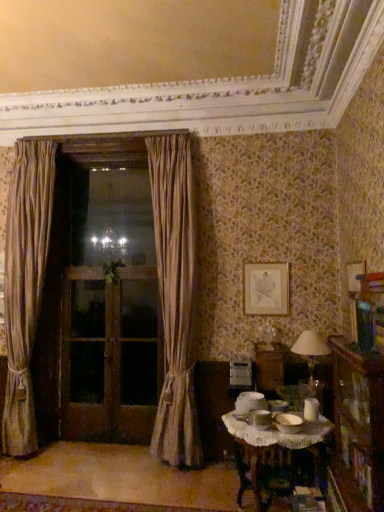
Question: Is wooden bookcase at lower right wider than brown wooden screen door at left, which ranks as the third screen door in right-to-left order?

Choices:
 (A) no
 (B) yes

Answer: (B)

Question: Can you confirm if wooden bookcase at lower right is thinner than brown wooden screen door at left, which is counted as the first screen door, starting from the left?

Choices:
 (A) yes
 (B) no

Answer: (B)

Question: Is wooden bookcase at lower right bigger than brown wooden screen door at left, which is counted as the first screen door, starting from the left?

Choices:
 (A) no
 (B) yes

Answer: (B)

Question: Does wooden bookcase at lower right touch brown wooden screen door at left, which ranks as the third screen door in right-to-left order?

Choices:
 (A) yes
 (B) no

Answer: (B)

Question: Does wooden bookcase at lower right contain brown wooden screen door at left, which is counted as the first screen door, starting from the left?

Choices:
 (A) yes
 (B) no

Answer: (B)

Question: In the image, is white fabric lampshade at right positioned in front of or behind white lace tablecloth at lower right?

Choices:
 (A) behind
 (B) front

Answer: (A)

Question: From the image's perspective, is white fabric lampshade at right above or below white lace tablecloth at lower right?

Choices:
 (A) above
 (B) below

Answer: (A)

Question: Choose the correct answer: Is white fabric lampshade at right inside white lace tablecloth at lower right or outside it?

Choices:
 (A) outside
 (B) inside

Answer: (A)

Question: From a real-world perspective, is white fabric lampshade at right physically located above or below white lace tablecloth at lower right?

Choices:
 (A) below
 (B) above

Answer: (B)

Question: From a real-world perspective, is wooden bookcase at lower right above or below brown wooden screen door at left, the second screen door from the right?

Choices:
 (A) above
 (B) below

Answer: (B)

Question: From the image's perspective, is wooden bookcase at lower right positioned above or below brown wooden screen door at left, arranged as the 2th screen door when viewed from the left?

Choices:
 (A) below
 (B) above

Answer: (B)

Question: Looking at the image, does wooden bookcase at lower right seem bigger or smaller compared to brown wooden screen door at left, the second screen door from the right?

Choices:
 (A) small
 (B) big

Answer: (B)

Question: Considering the relative positions of wooden bookcase at lower right and brown wooden screen door at left, arranged as the 2th screen door when viewed from the left, in the image provided, is wooden bookcase at lower right to the left or to the right of brown wooden screen door at left, arranged as the 2th screen door when viewed from the left,?

Choices:
 (A) right
 (B) left

Answer: (A)

Question: In the image, is brown wooden screen door at left, which ranks as the third screen door in right-to-left order, on the left side or the right side of brown wooden screen door at center, the 1th screen door positioned from the right?

Choices:
 (A) left
 (B) right

Answer: (A)

Question: Based on their sizes in the image, would you say brown wooden screen door at left, which ranks as the third screen door in right-to-left order, is bigger or smaller than brown wooden screen door at center, the 3th screen door from the left?

Choices:
 (A) big
 (B) small

Answer: (A)